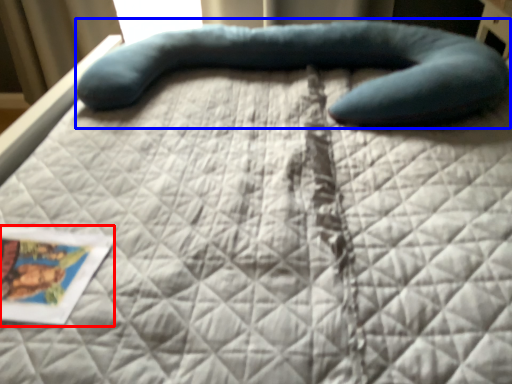
Question: Which of the following is the closest to the observer, postcard (highlighted by a red box) or bean bag chair (highlighted by a blue box)?

Choices:
 (A) postcard
 (B) bean bag chair

Answer: (A)